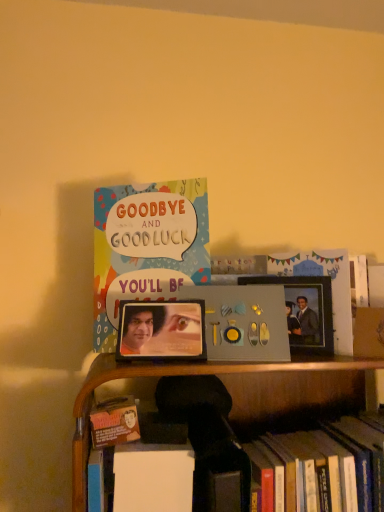
Question: Is point (188, 253) closer or farther from the camera than point (188, 309)?

Choices:
 (A) closer
 (B) farther

Answer: (B)

Question: Is multicolored paper card at upper center, marked as the 1th book in a left-to-right arrangement, taller or shorter than metallic photo frame at center, which is the second picture frame in right-to-left order?

Choices:
 (A) tall
 (B) short

Answer: (A)

Question: Which object is positioned farthest from the metallic silver photo frame at right, the first picture frame from the right?

Choices:
 (A) multicolored paper card at upper center, marked as the 1th book in a left-to-right arrangement
 (B) hardcover book at lower right, the first book positioned from the bottom
 (C) metallic photo frame at center, the 2th picture frame in the back-to-front sequence

Answer: (A)

Question: Based on their relative distances, which object is farther from the multicolored paper card at upper center, positioned as the 1th book in top-to-bottom order?

Choices:
 (A) metallic photo frame at center, the 2th picture frame in the back-to-front sequence
 (B) hardcover book at lower right, the first book positioned from the bottom
 (C) metallic silver photo frame at right, the first picture frame from the right

Answer: (B)